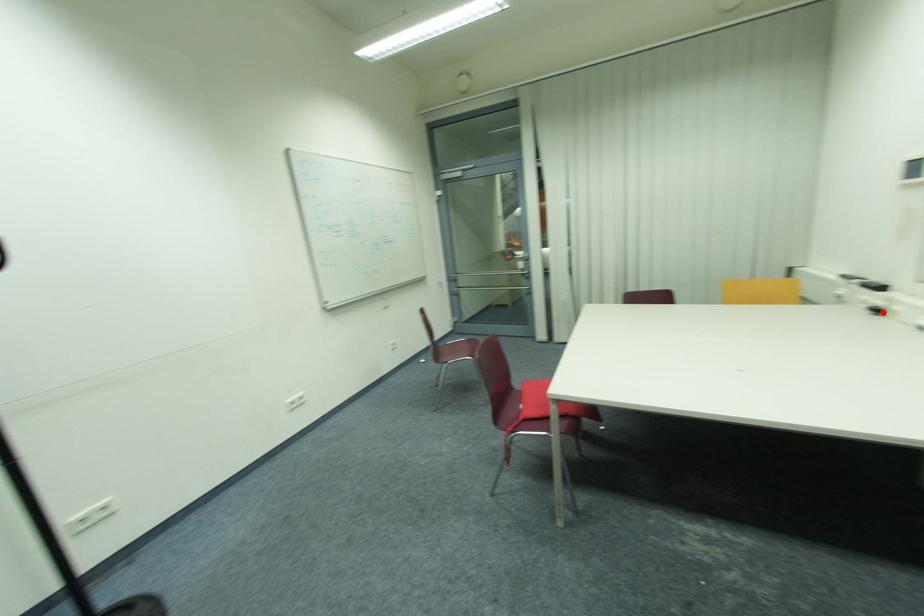
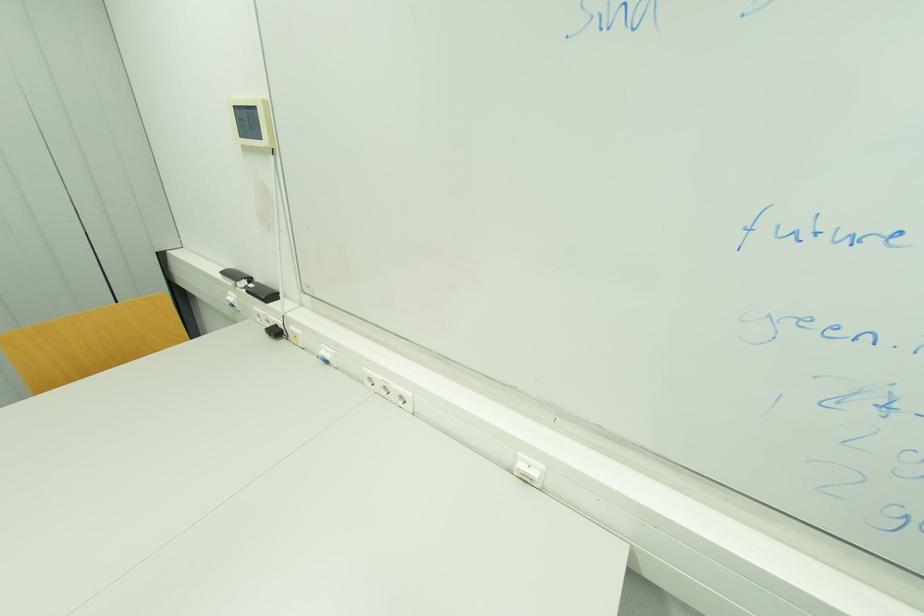
Locate, in the second image, the point that corresponds to the highlighted location in the first image.

(281, 333)